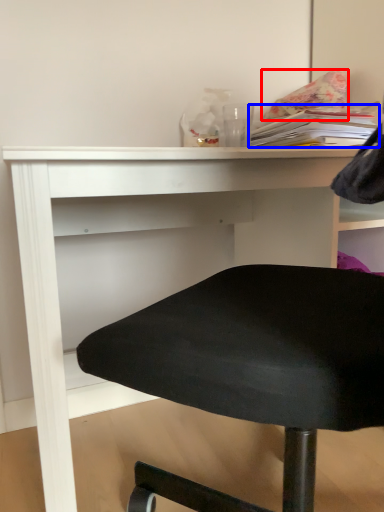
Question: Which of the following is the farthest to the observer, pillow (highlighted by a red box) or book (highlighted by a blue box)?

Choices:
 (A) pillow
 (B) book

Answer: (A)